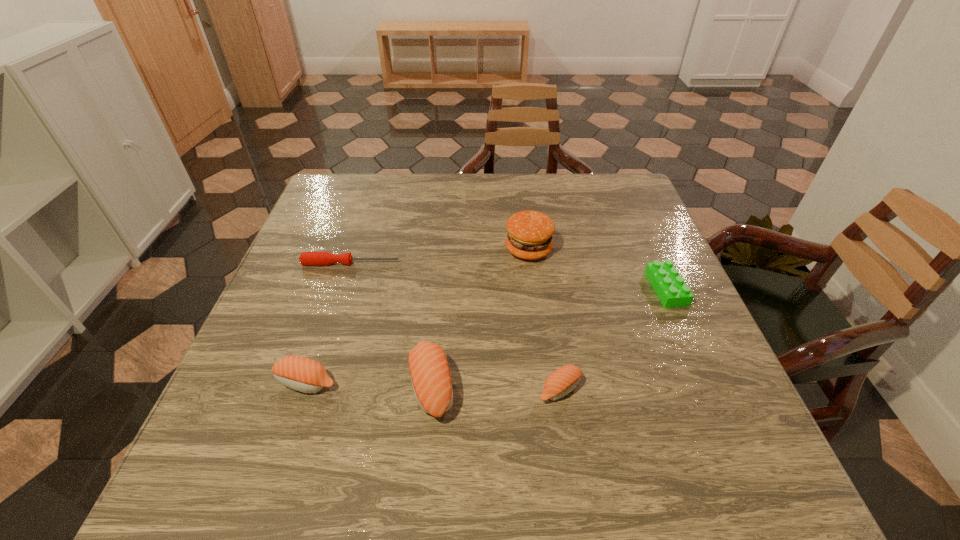
Find the location of `blank area located on the right of the fourth object from right to left`. blank area located on the right of the fourth object from right to left is located at coordinates (540, 386).

I want to click on vacant space located 0.230m on the left of the shortest sushi, so click(416, 389).

Where is `vacant point located on the left of the patty`? The height and width of the screenshot is (540, 960). vacant point located on the left of the patty is located at coordinates (486, 249).

I want to click on vacant region located 0.290m at the tip of the shortest object, so click(516, 263).

Locate an element on the screen. free space located on the left of the third farthest object is located at coordinates (608, 288).

You are a GUI agent. You are given a task and a screenshot of the screen. Output one action in this format:
    pyautogui.click(x=<x>, y=<y>)
    Task: Click on the sushi that is positioned at the left edge
    
    Given the screenshot: What is the action you would take?
    click(x=302, y=374)

At what (x,y) coordinates should I click in order to perform the action: click on screwdriver that is at the left edge. Please return your answer as a coordinate pair (x, y). The height and width of the screenshot is (540, 960). Looking at the image, I should click on click(306, 258).

Where is `object present at the right edge`? The image size is (960, 540). object present at the right edge is located at coordinates (670, 287).

At what (x,y) coordinates should I click in order to perform the action: click on object present at the near left corner. Please return your answer as a coordinate pair (x, y). The image size is (960, 540). Looking at the image, I should click on (302, 374).

In the image, there is a desktop. Identify the location of vacant space at the far edge. The image size is (960, 540). (437, 207).